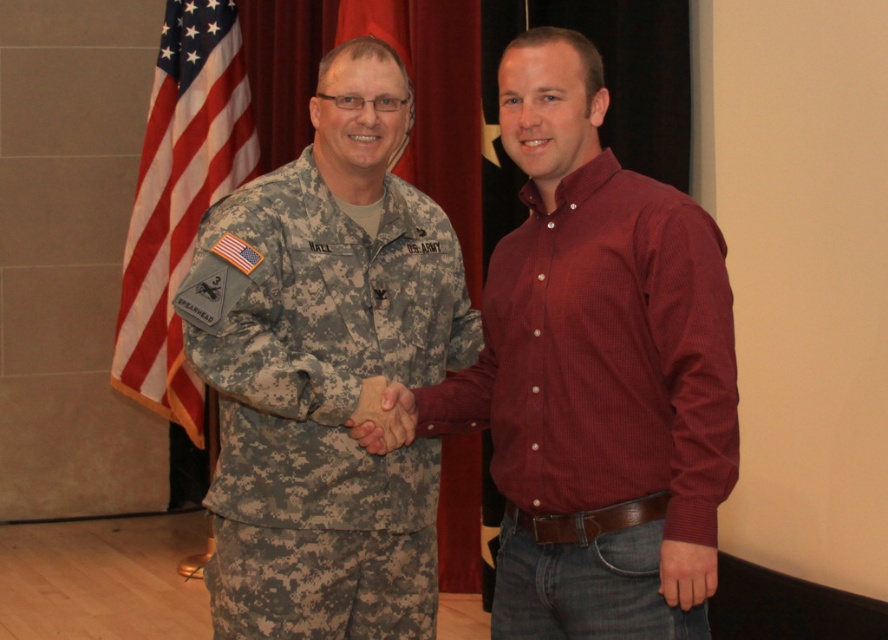
Question: Considering the real-world distances, which object is farthest from the matte red shirt at center?

Choices:
 (A) matte skin hand at center
 (B) camouflage fabric uniform at center

Answer: (B)

Question: Among these points, which one is farthest from the camera?

Choices:
 (A) (583, 604)
 (B) (382, 492)
 (C) (427, 160)

Answer: (C)

Question: Is the position of matte red shirt at center less distant than that of american flag at left?

Choices:
 (A) no
 (B) yes

Answer: (B)

Question: Which point appears farthest from the camera in this image?

Choices:
 (A) (635, 621)
 (B) (410, 58)
 (C) (379, 429)

Answer: (B)

Question: Can you confirm if camouflage fabric uniform at center is bigger than matte red shirt at center?

Choices:
 (A) yes
 (B) no

Answer: (A)

Question: Does camouflage fabric uniform at center appear on the right side of red flag at center?

Choices:
 (A) yes
 (B) no

Answer: (B)